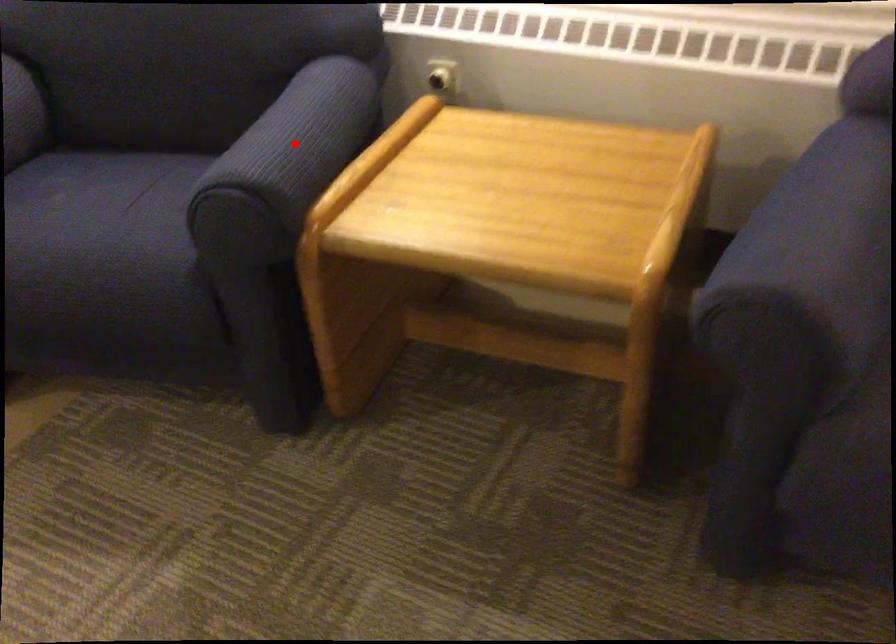
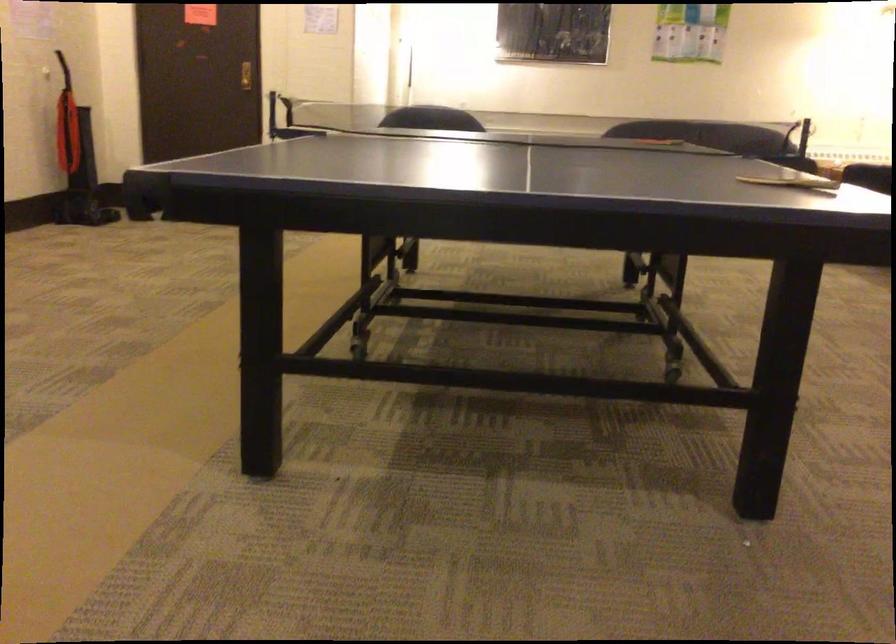
Question: I am providing you with two images of the same scene from different viewpoints. A red point is marked on the first image. At the location where the point appears in image 1, is it still visible in image 2?

Choices:
 (A) Yes
 (B) No

Answer: (B)